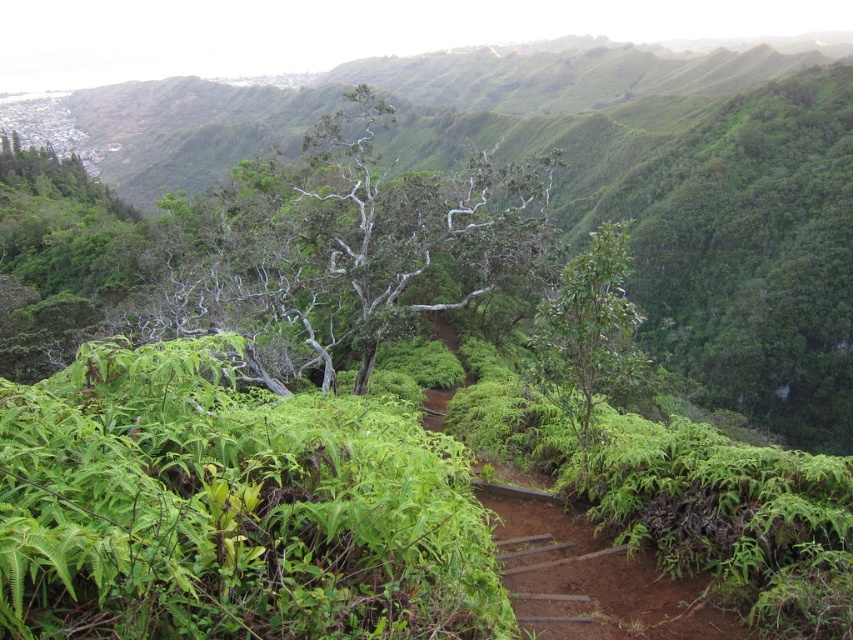
You are a hiker trying to navigate through the dense vegetation. You see the silver bark tree at center and the green glossy tree at center. Which tree would you choose to use as a landmark for navigation, and why?

The silver bark tree at center has a larger size compared to the green glossy tree at center, so it would be more visible and easier to identify as a landmark for navigation.